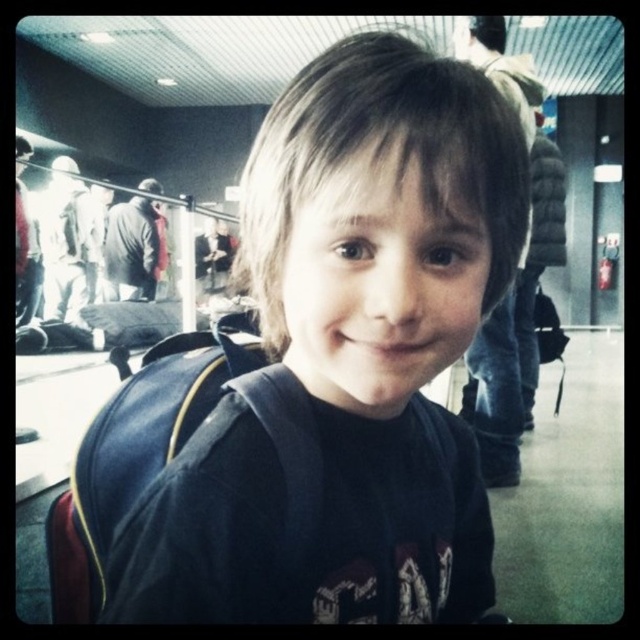
You are a delivery robot that needs to move a package from the dark blue backpack at center to the matte black backpack at center. The robot has a maximum carrying distance of 4 feet. Can the robot complete this task without needing to recharge?

The distance between the dark blue backpack at center and the matte black backpack at center is 4.36 feet, which exceeds the robot s 4 feet maximum carrying distance. The robot cannot complete the task without recharging.

You are a photographer trying to capture the dark blue backpack at center in your shot. Based on its position, where should you aim your camera to ensure it is centered in the frame?

The dark blue backpack at center is already positioned at the coordinates point (348, 356), so aiming your camera at that point will center it in the frame.